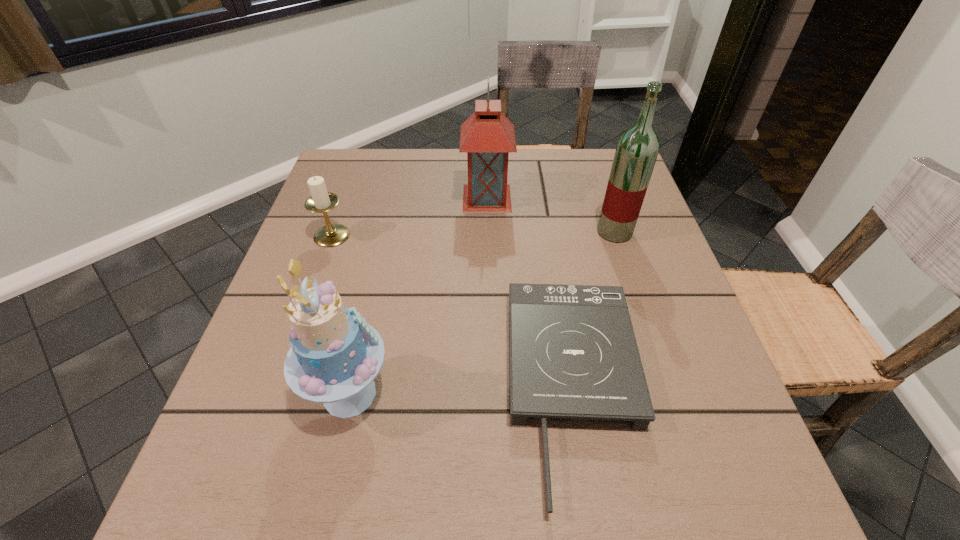
Identify the location of free region located 0.090m on the left of the hotplate. This screenshot has height=540, width=960. (455, 388).

Locate an element on the screen. The image size is (960, 540). object that is at the far edge is located at coordinates (487, 136).

Locate an element on the screen. The height and width of the screenshot is (540, 960). object at the near edge is located at coordinates (573, 353).

You are a GUI agent. You are given a task and a screenshot of the screen. Output one action in this format:
    pyautogui.click(x=<x>, y=<y>)
    Task: Click on the cake situated at the left edge
    This screenshot has height=540, width=960.
    Given the screenshot: What is the action you would take?
    pyautogui.click(x=335, y=356)

Image resolution: width=960 pixels, height=540 pixels. I want to click on candle holder positioned at the left edge, so click(x=320, y=201).

The image size is (960, 540). Identify the location of liquor that is at the right edge. (637, 149).

I want to click on hotplate located at the right edge, so click(x=573, y=353).

This screenshot has height=540, width=960. Identify the location of object that is at the near right corner. (573, 353).

You are a GUI agent. You are given a task and a screenshot of the screen. Output one action in this format:
    pyautogui.click(x=<x>, y=<y>)
    Task: Click on the vacant region at the far edge
    
    Given the screenshot: What is the action you would take?
    pyautogui.click(x=468, y=175)

Image resolution: width=960 pixels, height=540 pixels. Find the location of `free space at the near edge of the desktop`. free space at the near edge of the desktop is located at coordinates (370, 493).